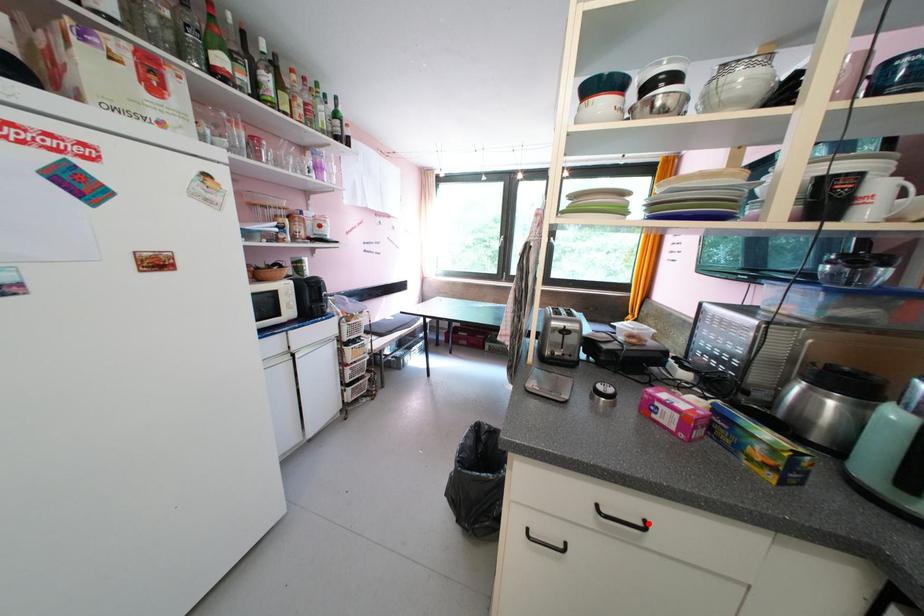
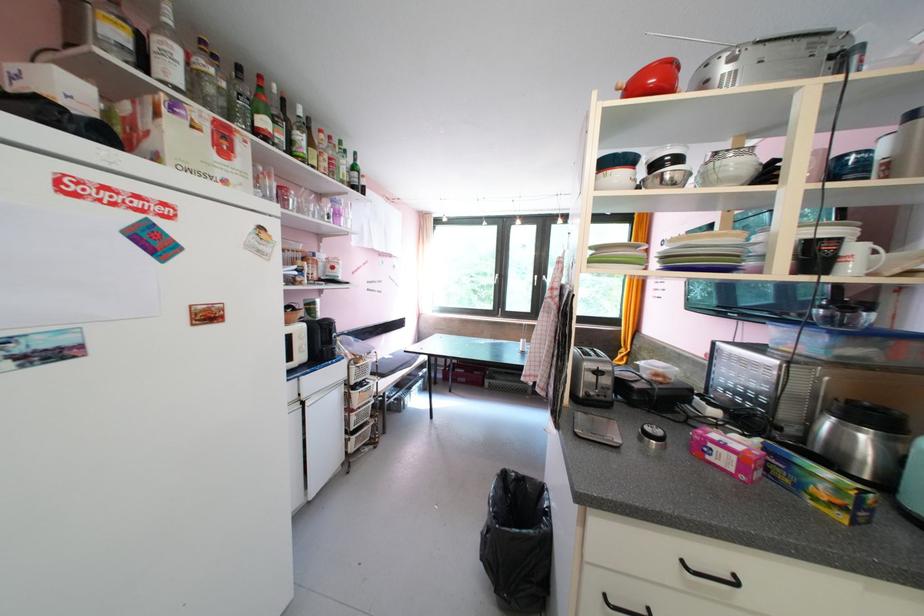
Question: I am providing you with two images of the same scene from different viewpoints. A red point is marked on the first image. Can you still see the location of the red point in image 2?

Choices:
 (A) Yes
 (B) No

Answer: (A)